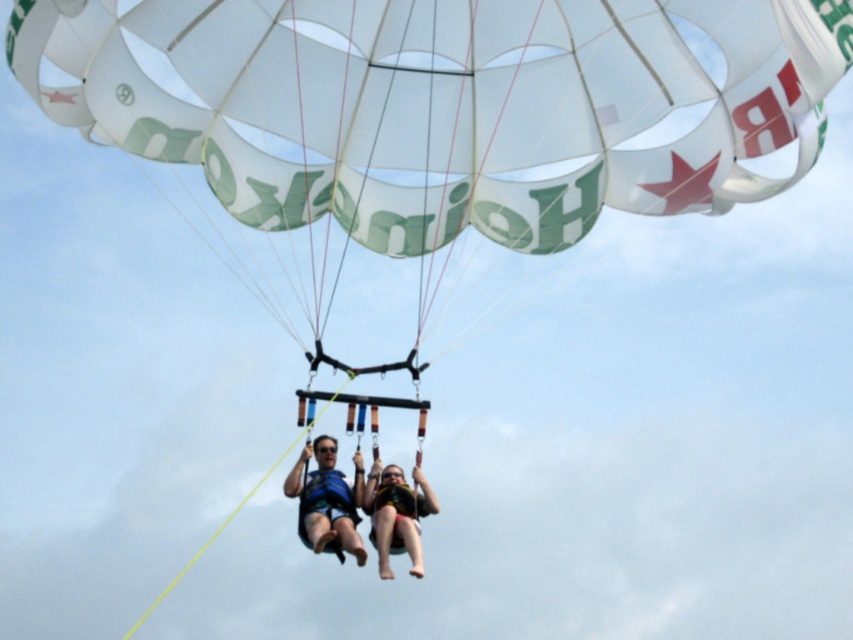
Is black life vest at center taller than matte yellow life vest at center?

Yes.

From the picture: Is black life vest at center closer to camera compared to matte yellow life vest at center?

Yes.

Is point (393, 518) positioned in front of point (380, 497)?

Yes, it is in front of point (380, 497).

Find the location of a particular element. The height and width of the screenshot is (640, 853). black life vest at center is located at coordinates (358, 506).

Between black life vest at center and blue life vest at center, which one has less height?

With less height is blue life vest at center.

Locate an element on the screen. Image resolution: width=853 pixels, height=640 pixels. black life vest at center is located at coordinates (358, 506).

Locate an element on the screen. The width and height of the screenshot is (853, 640). black life vest at center is located at coordinates (358, 506).

Is point (300, 497) farther from camera compared to point (387, 554)?

Yes, point (300, 497) is behind point (387, 554).

Who is more forward, (283,492) or (415,545)?

Point (415,545)

Where is `blue life vest at center`? blue life vest at center is located at coordinates (328, 500).